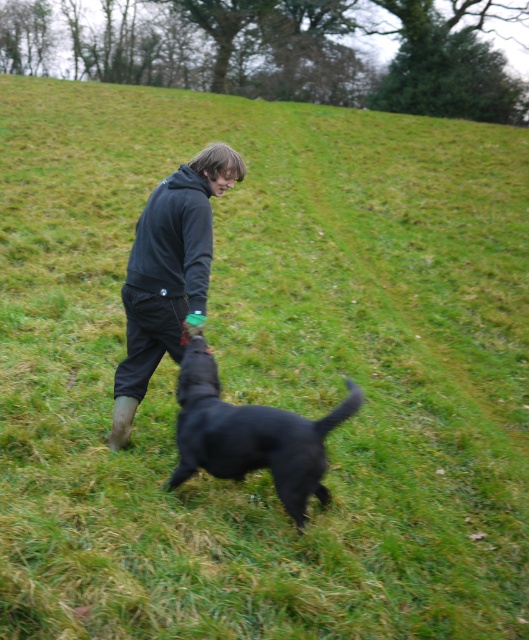
Question: Is dark gray hoodie at center bigger than black matte dog at center?

Choices:
 (A) no
 (B) yes

Answer: (B)

Question: Which of the following is the farthest from the observer?

Choices:
 (A) black matte dog at center
 (B) dark gray hoodie at center

Answer: (B)

Question: Is dark gray hoodie at center wider than black matte dog at center?

Choices:
 (A) no
 (B) yes

Answer: (A)

Question: Does dark gray hoodie at center come in front of black matte dog at center?

Choices:
 (A) yes
 (B) no

Answer: (B)